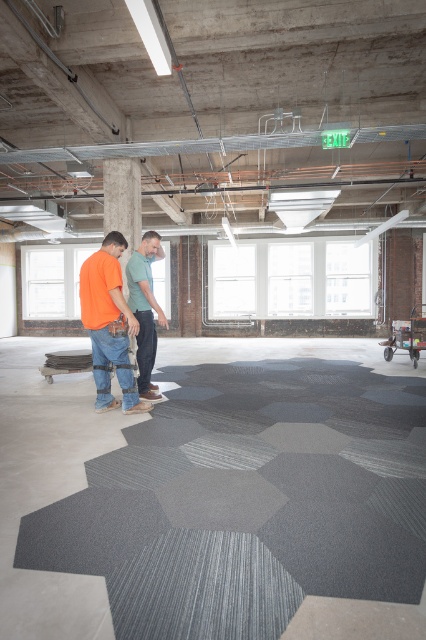
Question: Among these objects, which one is nearest to the camera?

Choices:
 (A) matte green shirt at center
 (B) matte orange shirt at center

Answer: (B)

Question: Which of the following is the farthest from the observer?

Choices:
 (A) matte green shirt at center
 (B) matte orange shirt at center

Answer: (A)

Question: Is matte orange shirt at center bigger than matte green shirt at center?

Choices:
 (A) no
 (B) yes

Answer: (B)

Question: Is the position of matte orange shirt at center more distant than that of matte green shirt at center?

Choices:
 (A) no
 (B) yes

Answer: (A)

Question: Is matte orange shirt at center to the right of matte green shirt at center from the viewer's perspective?

Choices:
 (A) no
 (B) yes

Answer: (A)